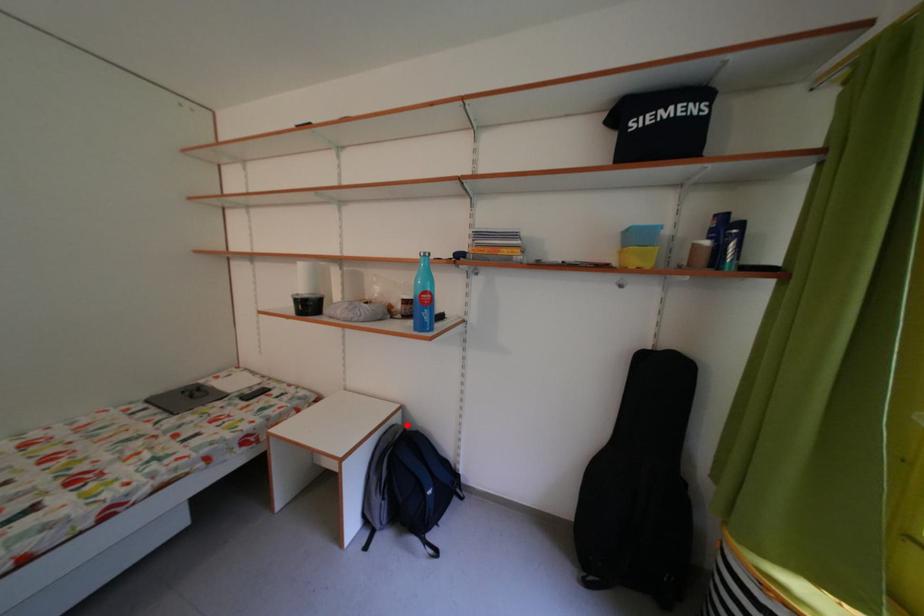
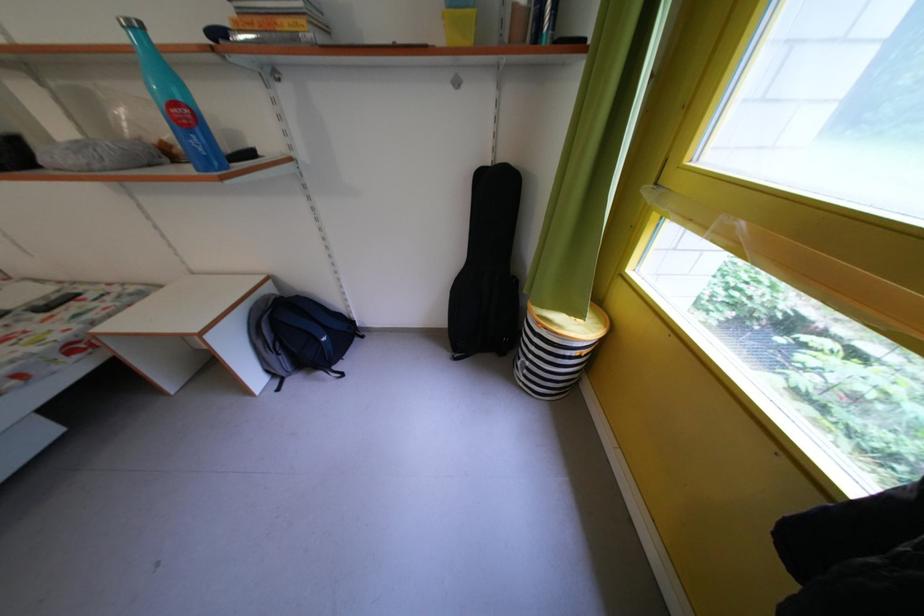
Question: I am providing you with two images of the same scene from different viewpoints. A red point is shown in image1. For the corresponding object point in image2, is it positioned nearer or farther from the camera?

Choices:
 (A) Nearer
 (B) Farther

Answer: (A)